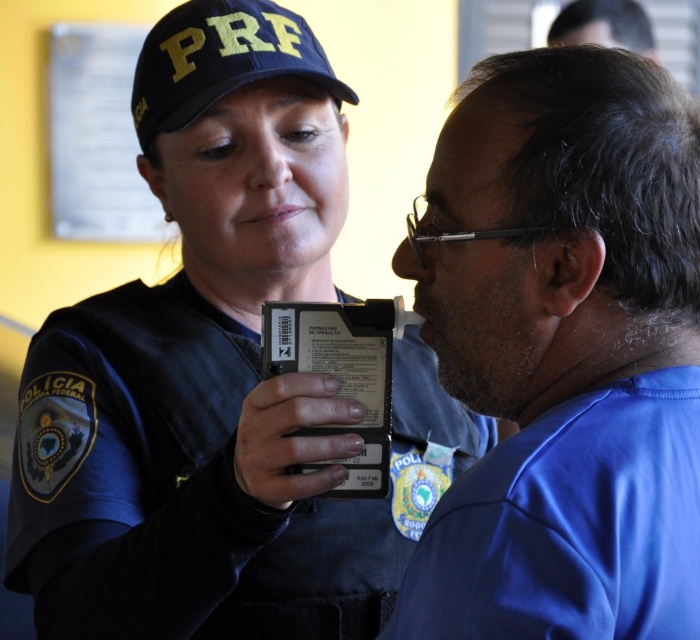
Question: Which point is closer to the camera?

Choices:
 (A) black matte uniform at center
 (B) blue fabric shirt at center

Answer: (B)

Question: Which is nearer to the blue fabric shirt at right?

Choices:
 (A) black matte uniform at center
 (B) dark brown hair at upper right

Answer: (A)

Question: Is black matte uniform at center thinner than dark brown hair at upper right?

Choices:
 (A) no
 (B) yes

Answer: (A)

Question: Does black plastic card at center have a greater width compared to dark brown hair at upper right?

Choices:
 (A) no
 (B) yes

Answer: (A)

Question: Which object appears closest to the camera in this image?

Choices:
 (A) black plastic card at center
 (B) blue fabric shirt at right
 (C) black matte uniform at center
 (D) dark brown hair at upper right

Answer: (B)

Question: From the image, what is the correct spatial relationship of black matte uniform at center in relation to black plastic card at center?

Choices:
 (A) below
 (B) above

Answer: (B)